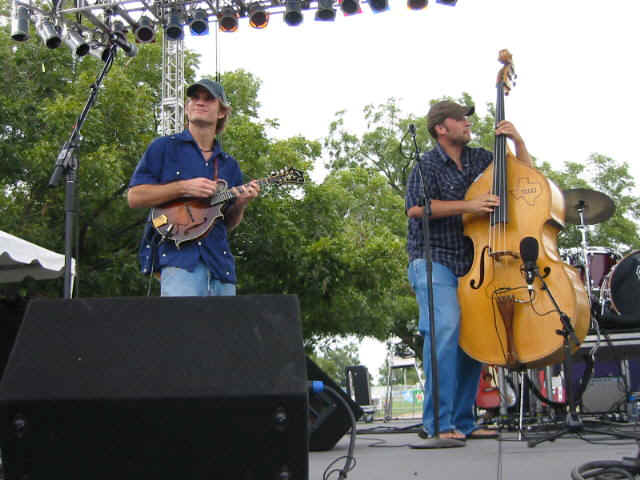
You are a GUI agent. You are given a task and a screenshot of the screen. Output one action in this format:
    pyautogui.click(x=<x>, y=<y>)
    Task: Click on the speakers
    
    Given the screenshot: What is the action you would take?
    pyautogui.click(x=259, y=343)